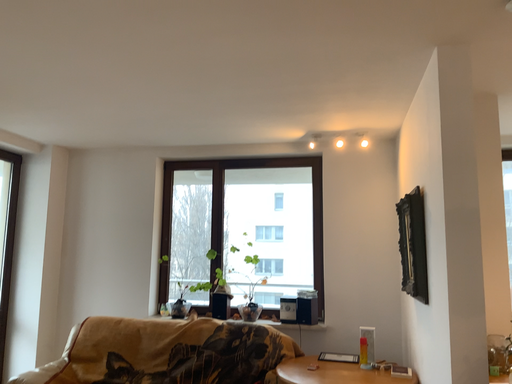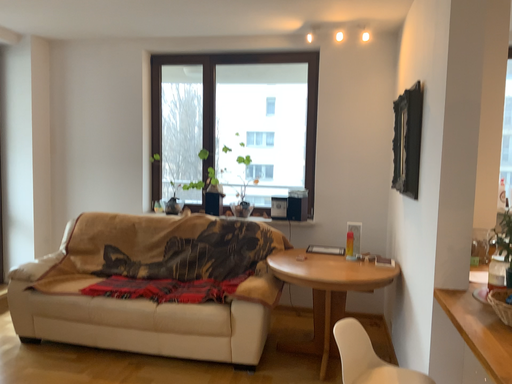
Question: How did the camera likely rotate when shooting the video?

Choices:
 (A) rotated upward
 (B) rotated downward

Answer: (B)